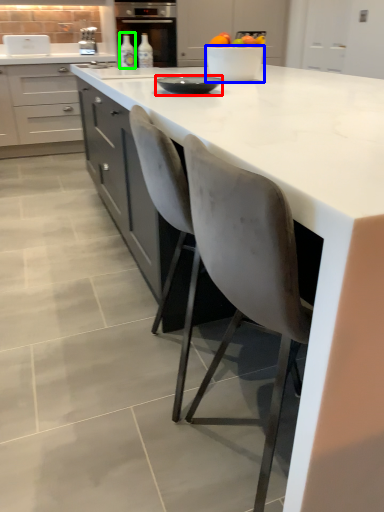
Question: Based on their relative distances, which object is farther from tableware (highlighted by a red box)? Choose from bowl (highlighted by a blue box) and bottle (highlighted by a green box).

Choices:
 (A) bowl
 (B) bottle

Answer: (B)